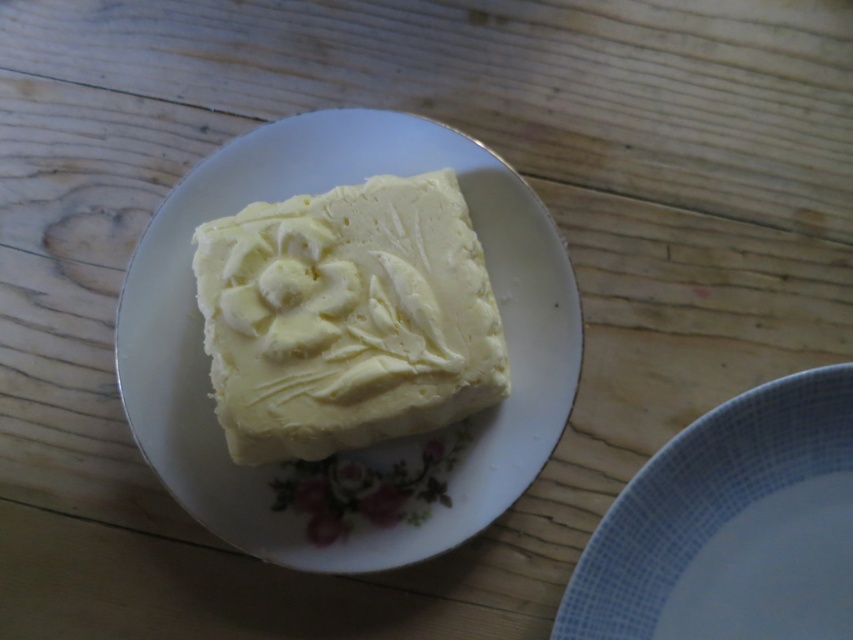
Is white porcelain plate at center shorter than white ceramic plate at lower right?

Incorrect, white porcelain plate at center's height does not fall short of white ceramic plate at lower right's.

Find the location of a particular element. The image size is (853, 640). white porcelain plate at center is located at coordinates 379,444.

Which of these two, white creamy butter at center or white ceramic plate at lower right, stands shorter?

With less height is white ceramic plate at lower right.

Is white creamy butter at center smaller than white ceramic plate at lower right?

No, white creamy butter at center is not smaller than white ceramic plate at lower right.

Is point (230, 444) more distant than point (646, 628)?

That is True.

Locate an element on the screen. The width and height of the screenshot is (853, 640). white creamy butter at center is located at coordinates (347, 317).

Is white porcelain plate at center thinner than white creamy butter at center?

No, white porcelain plate at center is not thinner than white creamy butter at center.

Between point (195, 392) and point (291, 218), which one is positioned behind?

Point (195, 392)

Find the location of a particular element. white porcelain plate at center is located at coordinates (379, 444).